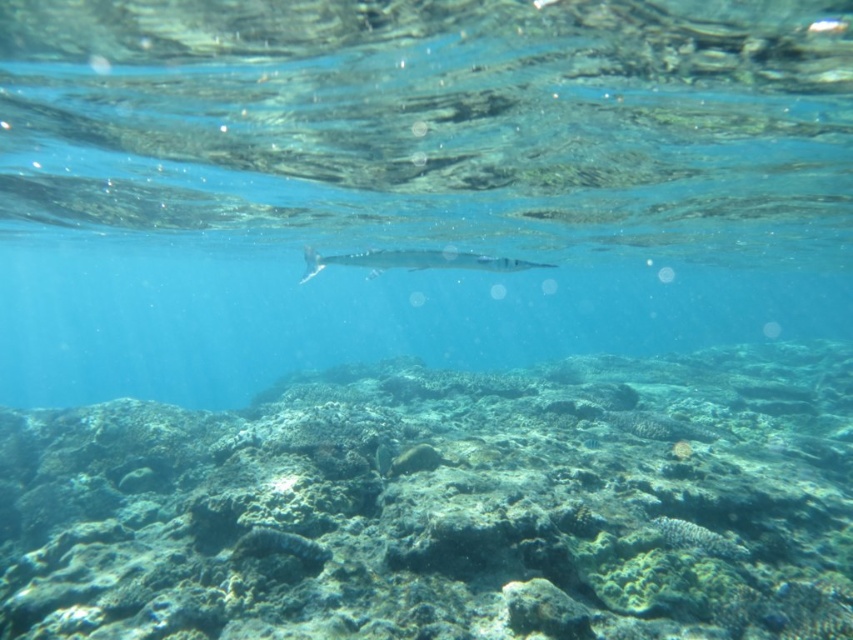
You are a diver swimming in the underwater scene and want to navigate between the two points marked as point [434,100] and point [700,568]. Which point is closer to you?

Point [434,100] is closer to you than point [700,568] because it is further to the viewer.

You are a diver who wants to take a photo of the barracuda fish. There is a point marked at coordinates [410,182] in the image. Where is this point located relative to the barracuda fish?

The point at [410,182] indicates clear blue water at center, so it is located in the center of the image, not near the barracuda fish.